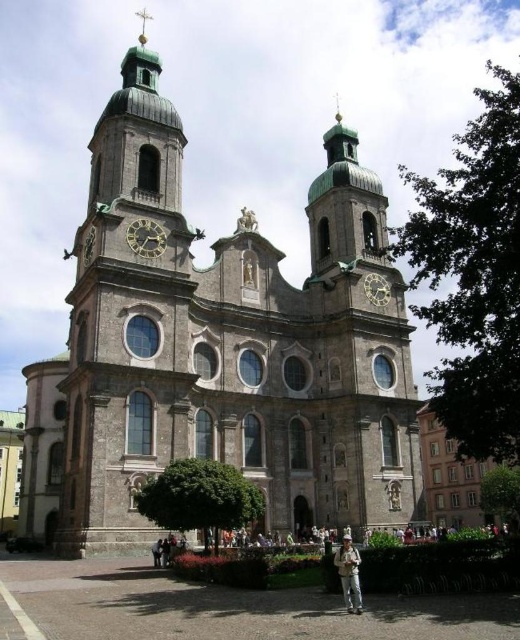
Question: Is gray stone church at center positioned behind khaki fabric jacket at lower center?

Choices:
 (A) yes
 (B) no

Answer: (A)

Question: Which is nearer to the polished brass clock at center?

Choices:
 (A) gold/gilded metal cross at upper center
 (B) gold metallic clock at center

Answer: (B)

Question: Based on their relative distances, which object is farther from the gray stone church at center?

Choices:
 (A) polished brass clock at center
 (B) khaki fabric jacket at lower center
 (C) gold metallic clock at center
 (D) gold/gilded metal cross at upper center

Answer: (D)

Question: Does khaki fabric jacket at lower center have a greater width compared to gold/gilded metal cross at upper center?

Choices:
 (A) no
 (B) yes

Answer: (A)

Question: Which of these objects is positioned farthest from the gold/gilded metal cross at upper center?

Choices:
 (A) khaki fabric jacket at lower center
 (B) gray stone church at center
 (C) polished brass clock at center
 (D) gold metallic clock at center

Answer: (A)

Question: Does khaki fabric jacket at lower center have a smaller size compared to gold/gilded metal cross at upper center?

Choices:
 (A) yes
 (B) no

Answer: (B)